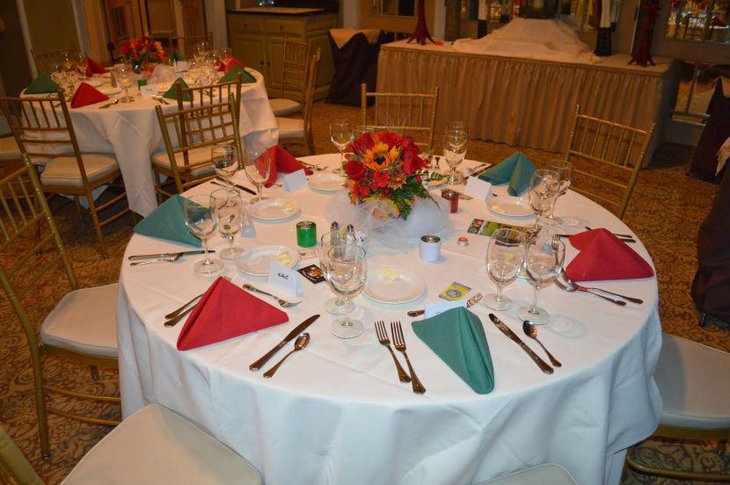
You are a GUI agent. You are given a task and a screenshot of the screen. Output one action in this format:
    pyautogui.click(x=<x>, y=<y>)
    Task: Click on the red napkin
    This screenshot has width=730, height=485.
    Given the screenshot: What is the action you would take?
    pyautogui.click(x=233, y=305)